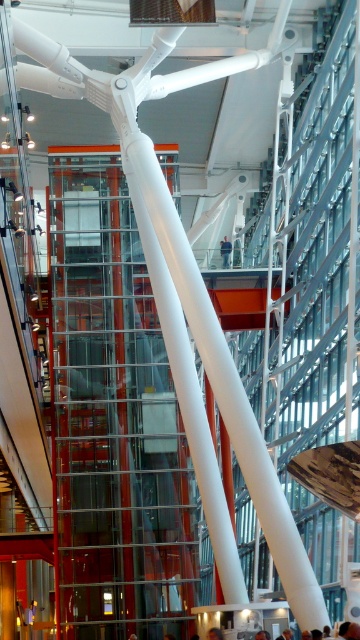
Question: Which is farther from the brown hair at center?

Choices:
 (A) blue denim jacket at center
 (B) orange fabric person at center

Answer: (A)

Question: Considering the relative positions of blue denim jacket at center and brown hair at center in the image provided, where is blue denim jacket at center located with respect to brown hair at center?

Choices:
 (A) left
 (B) right

Answer: (B)

Question: Which object is positioned closest to the orange fabric person at center?

Choices:
 (A) brown hair at center
 (B) blue denim jacket at center

Answer: (A)

Question: Which of the following is the farthest from the observer?

Choices:
 (A) orange fabric person at center
 (B) blue denim jacket at center
 (C) brown hair at center

Answer: (B)

Question: Can you confirm if blue denim jacket at center is thinner than brown hair at center?

Choices:
 (A) yes
 (B) no

Answer: (A)

Question: Does orange fabric person at center appear on the left side of brown hair at center?

Choices:
 (A) no
 (B) yes

Answer: (A)